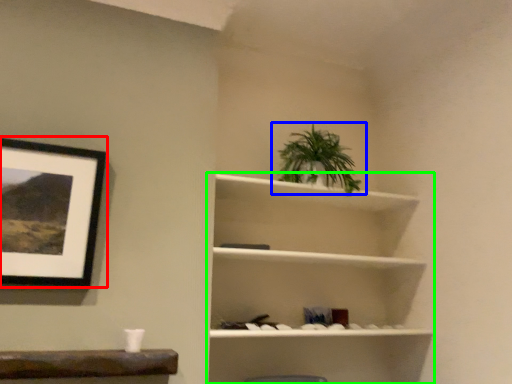
Question: Considering the real-world distances, which object is closest to picture frame (highlighted by a red box)? houseplant (highlighted by a blue box) or shelf (highlighted by a green box).

Choices:
 (A) houseplant
 (B) shelf

Answer: (B)